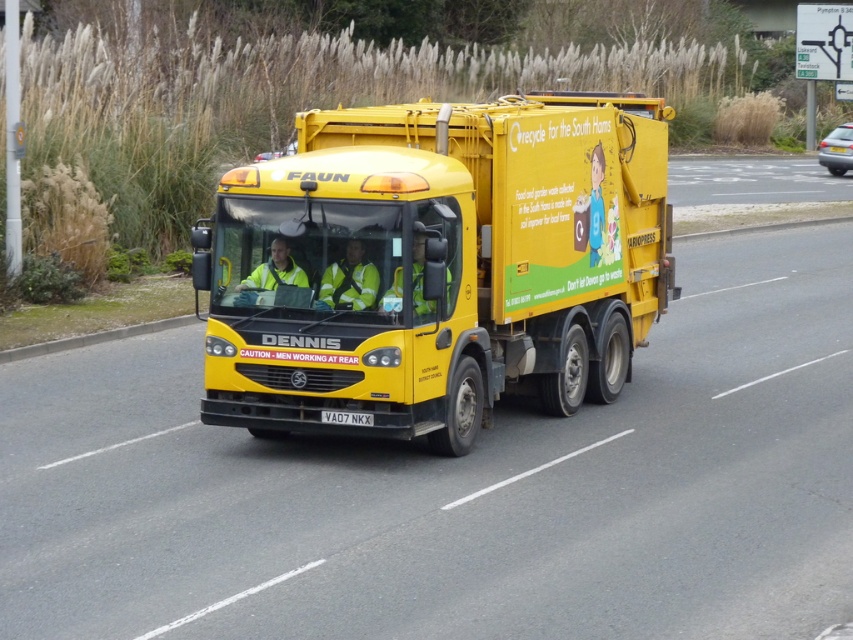
You are a pedestrian standing on the sidewalk next to the road where the FAUN refuse collection vehicle is driving. You see the metallic silver car at right and the black plastic license plate at center. Which object would appear closer to you if you were looking straight ahead?

The metallic silver car at right appears closer because it is larger in size than the black plastic license plate at center, and larger objects typically appear closer when viewed from the same distance.

You are a pedestrian standing on the sidewalk next to the road. You see the yellow matte trailer truck at center and the black plastic license plate at center. Which object is closer to the left side of the road?

The yellow matte trailer truck at center is positioned on the left side of black plastic license plate at center, so it is closer to the left side of the road.

Based on the photo, you are a pedestrian standing in front of the black plastic license plate at center. You want to cross the road to reach the metallic silver car at right. Which direction should you walk to get there?

The metallic silver car at right is located to the right of the black plastic license plate at center, so you should walk to the right to reach it.